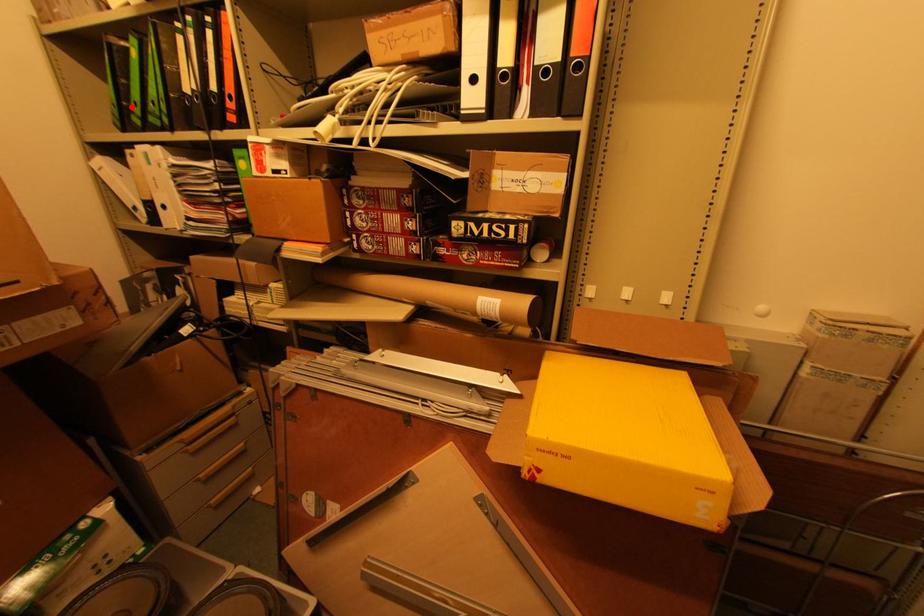
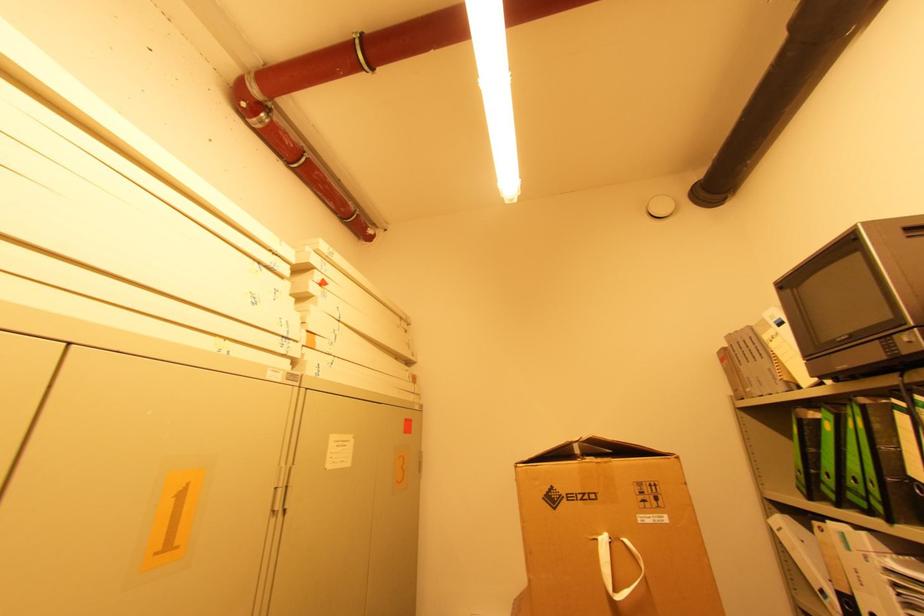
Question: I am providing you with two images of the same scene from different viewpoints. Image1 has a red point marked. In image2, the corresponding 3D location appears at what relative position? Reply with the corresponding letter.

Choices:
 (A) Closer
 (B) Farther

Answer: (A)